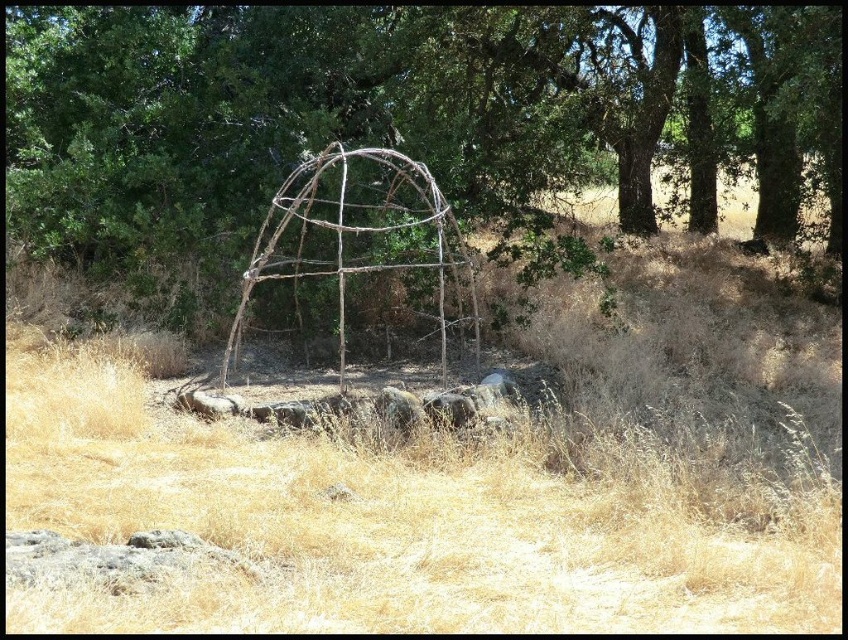
Based on the photo, which is more to the left, dry grass at center or brown wood structure at center?

brown wood structure at center is more to the left.

Can you confirm if dry grass at center is positioned to the left of brown wood structure at center?

In fact, dry grass at center is to the right of brown wood structure at center.

Which is in front, point (644, 296) or point (32, 241)?

Point (32, 241) is in front.

I want to click on dry grass at center, so click(x=450, y=483).

Does brown wood structure at center have a lesser width compared to brown rustic gazebo at center?

In fact, brown wood structure at center might be wider than brown rustic gazebo at center.

Is point (687, 84) farther from viewer compared to point (458, 301)?

Yes, point (687, 84) is farther from viewer.

Identify the location of brown wood structure at center. This screenshot has height=640, width=848. (404, 112).

Is point (604, 584) closer to camera compared to point (307, 228)?

Yes, it is.

Which is more to the right, dry grass at center or brown rustic gazebo at center?

dry grass at center

At what (x,y) coordinates should I click in order to perform the action: click on dry grass at center. Please return your answer as a coordinate pair (x, y). The width and height of the screenshot is (848, 640). Looking at the image, I should click on (450, 483).

This screenshot has height=640, width=848. What are the coordinates of `dry grass at center` in the screenshot? It's located at (x=450, y=483).